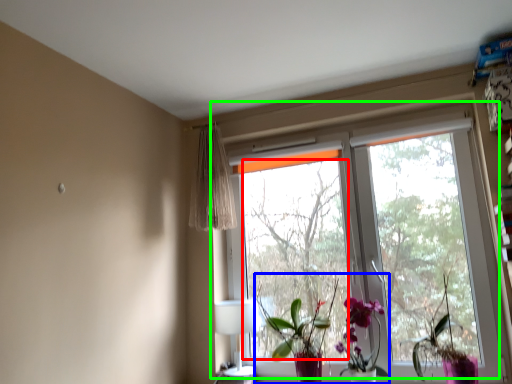
Question: Which object is the closest to the tree (highlighted by a red box)? Choose among these: floral arrangement (highlighted by a blue box) or window (highlighted by a green box).

Choices:
 (A) floral arrangement
 (B) window

Answer: (B)